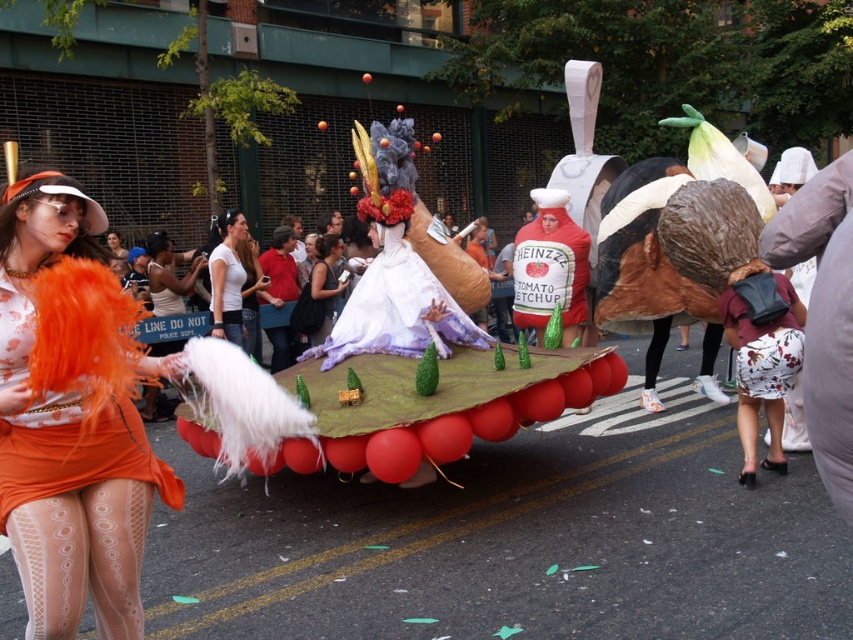
Question: Is white matte shirt at center to the right of matte white dress at center from the viewer's perspective?

Choices:
 (A) yes
 (B) no

Answer: (B)

Question: Which point appears farthest from the camera in this image?

Choices:
 (A) (15, 276)
 (B) (331, 268)

Answer: (B)

Question: Which object appears farthest from the camera in this image?

Choices:
 (A) white fluffy feathers at center
 (B) white matte shirt at center
 (C) matte white dress at center
 (D) matte orange dress at left

Answer: (C)

Question: Which object is closer to the camera taking this photo?

Choices:
 (A) matte white dress at center
 (B) white fluffy feathers at center
 (C) white matte shirt at center
 (D) matte orange dress at left

Answer: (D)

Question: Can you confirm if matte orange dress at left is positioned above matte white dress at center?

Choices:
 (A) yes
 (B) no

Answer: (B)

Question: Considering the relative positions of matte orange dress at left and white matte shirt at center in the image provided, where is matte orange dress at left located with respect to white matte shirt at center?

Choices:
 (A) left
 (B) right

Answer: (B)